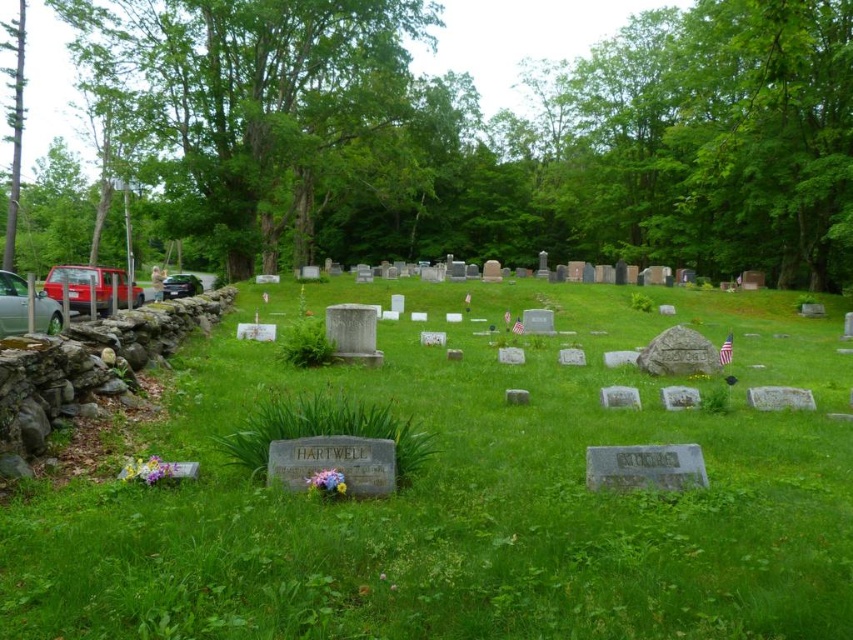
Question: Does green leafy tree at upper center lie behind gray stone at right?

Choices:
 (A) no
 (B) yes

Answer: (B)

Question: Which point appears farthest from the camera in this image?

Choices:
 (A) (164, 284)
 (B) (19, 291)
 (C) (612, 392)

Answer: (A)

Question: Is green grass at center further to camera compared to green leafy tree at upper center?

Choices:
 (A) yes
 (B) no

Answer: (B)

Question: Which object is positioned closest to the gray stone at right?

Choices:
 (A) gray stone at center
 (B) green grass at center
 (C) shiny black car at left

Answer: (A)

Question: Is white marble gravestone at center closer to the viewer compared to shiny black car at left?

Choices:
 (A) yes
 (B) no

Answer: (A)

Question: Among these points, which one is nearest to the camera?

Choices:
 (A) (219, 262)
 (B) (55, 305)

Answer: (B)